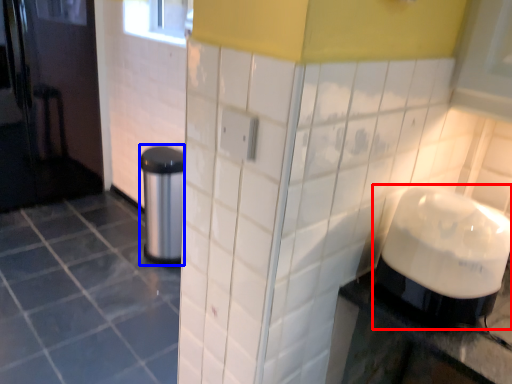
Question: Which object appears closest to the camera in this image, blender (highlighted by a red box) or appliance (highlighted by a blue box)?

Choices:
 (A) blender
 (B) appliance

Answer: (A)